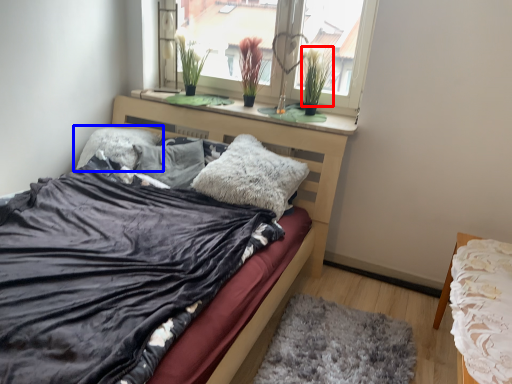
Question: Which object is further to the camera taking this photo, plant (highlighted by a red box) or pillow (highlighted by a blue box)?

Choices:
 (A) plant
 (B) pillow

Answer: (B)